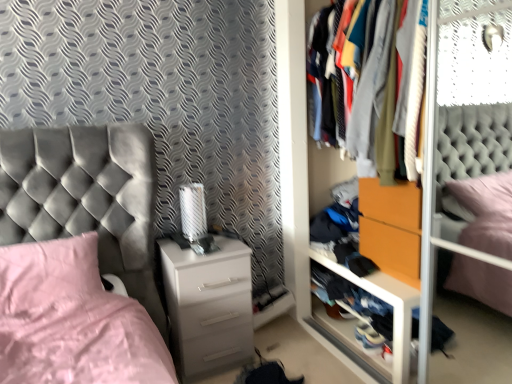
At what (x,y) coordinates should I click in order to perform the action: click on free point above white glossy chest of drawers at center (from a real-world perspective). Please return your answer as a coordinate pair (x, y). Looking at the image, I should click on (210, 244).